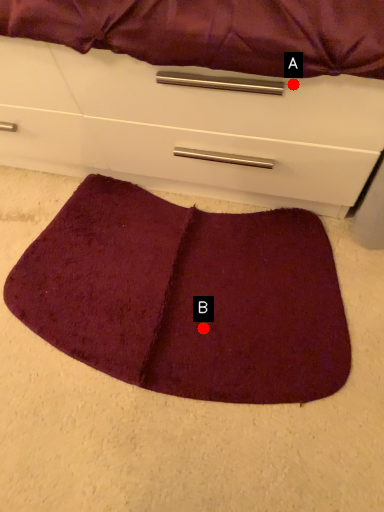
Question: Two points are circled on the image, labeled by A and B beside each circle. Which point is closer to the camera?

Choices:
 (A) A is closer
 (B) B is closer

Answer: (A)